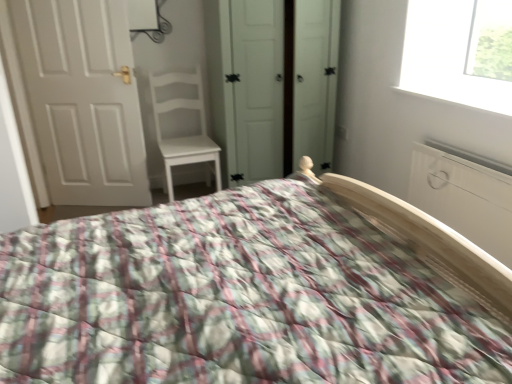
Question: Does point (338, 205) appear closer or farther from the camera than point (179, 87)?

Choices:
 (A) farther
 (B) closer

Answer: (B)

Question: Considering the positions of fluffy quilted bed at center and white matte chair at center in the image, is fluffy quilted bed at center wider or thinner than white matte chair at center?

Choices:
 (A) wide
 (B) thin

Answer: (A)

Question: Based on their relative distances, which object is nearer to the white matte radiator at right?

Choices:
 (A) white matte wardrobe at center
 (B) white matte chair at center
 (C) white matte door at left
 (D) fluffy quilted bed at center

Answer: (D)

Question: Which of these objects is positioned closest to the white matte chair at center?

Choices:
 (A) fluffy quilted bed at center
 (B) white matte wardrobe at center
 (C) white matte door at left
 (D) white matte radiator at right

Answer: (C)